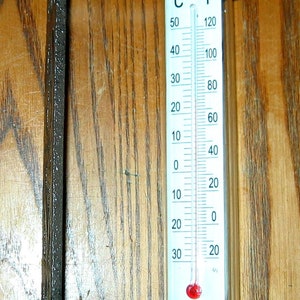
At what (x,y) coordinates should I click in order to perform the action: click on wall. Please return your answer as a coordinate pair (x, y). The height and width of the screenshot is (300, 300). Looking at the image, I should click on (130, 218).